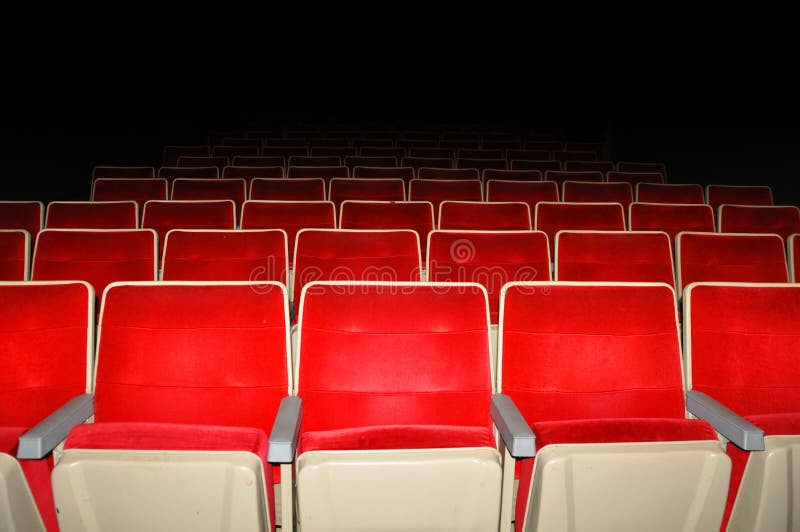
The height and width of the screenshot is (532, 800). What are the coordinates of `seats in front row` in the screenshot? It's located at (782, 371), (560, 377), (413, 379), (166, 385), (34, 358).